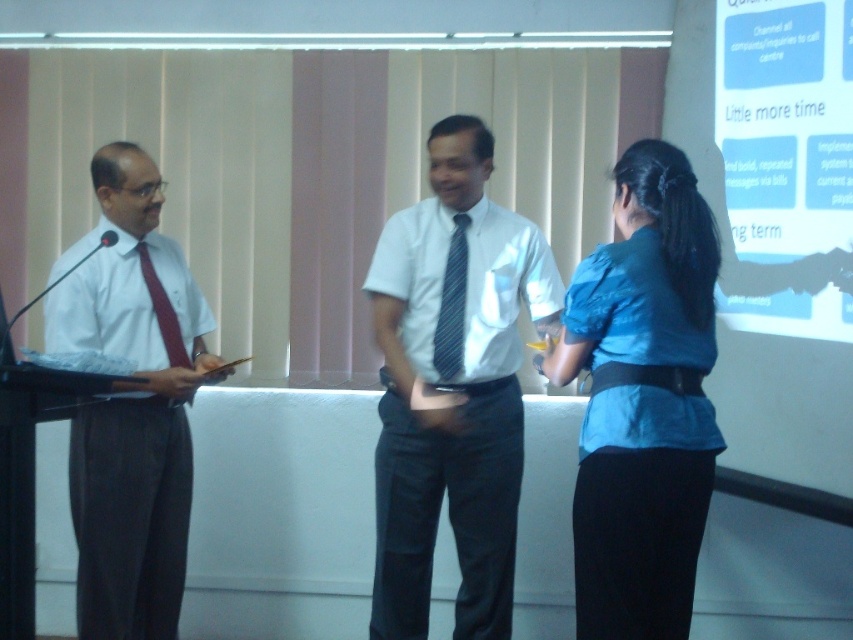
Question: Which of the following is the closest to the observer?

Choices:
 (A) (129, 209)
 (B) (685, 419)
 (C) (466, 243)
 (D) (550, 305)

Answer: (B)

Question: Can you confirm if blue striped tie at center is thinner than matte red tie at left?

Choices:
 (A) no
 (B) yes

Answer: (B)

Question: Which point is closer to the camera?

Choices:
 (A) (512, 483)
 (B) (438, 326)
 (C) (782, 3)
 (D) (698, 529)

Answer: (D)

Question: Is white glossy shirt at center thinner than matte white shirt at left?

Choices:
 (A) no
 (B) yes

Answer: (A)

Question: Is white glossy projection screen at upper right bigger than blue striped tie at center?

Choices:
 (A) no
 (B) yes

Answer: (B)

Question: Which point is closer to the camera taking this photo?

Choices:
 (A) (51, 268)
 (B) (608, 344)
 (C) (442, 372)

Answer: (B)